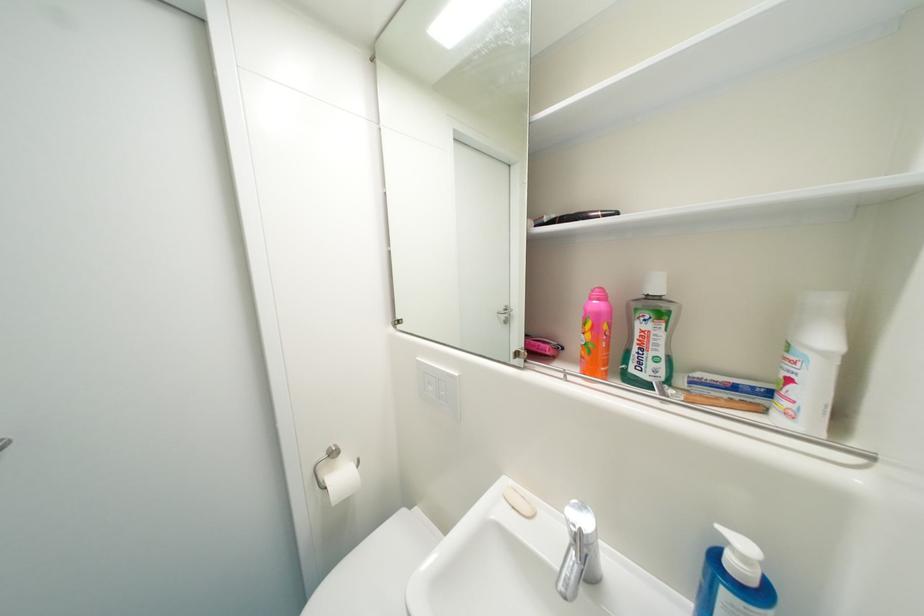
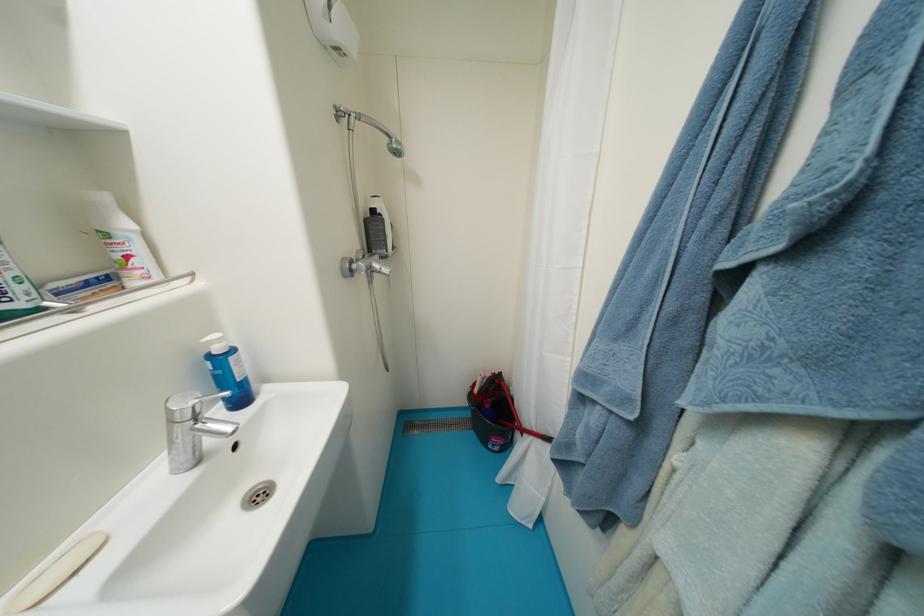
In the second image, find the point that corresponds to [750,560] in the first image.

(225, 342)